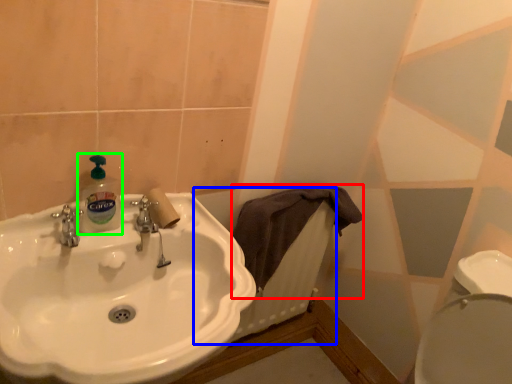
Question: Based on their relative distances, which object is nearer to bath towel (highlighted by a red box)? Choose from radiator (highlighted by a blue box) and cleaning product (highlighted by a green box).

Choices:
 (A) radiator
 (B) cleaning product

Answer: (A)